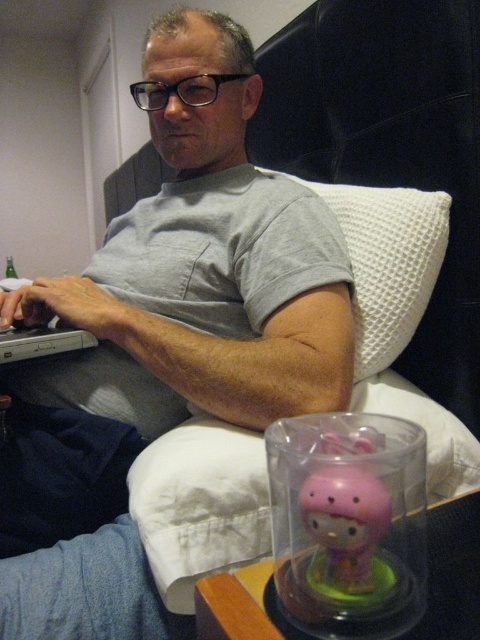
You are a delivery person who needs to place a small package on the tallest object in the room. Which object should you choose between the gray cotton shirt at upper center and the pink plastic piggy bank at lower right?

The gray cotton shirt at upper center is taller than the pink plastic piggy bank at lower right, so you should place the package on the gray cotton shirt at upper center.